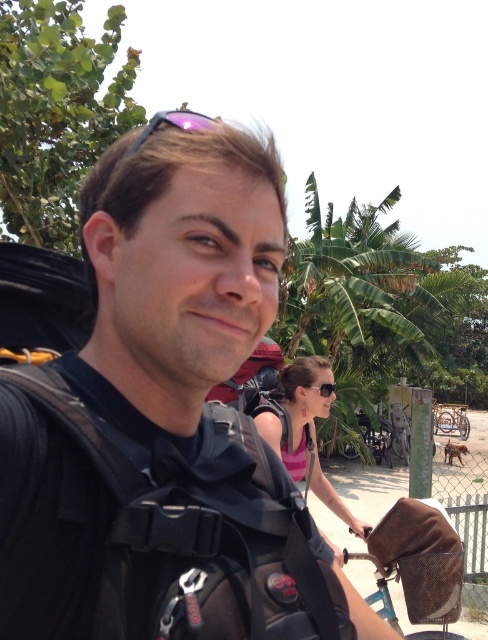
Is black backpack at center positioned at the back of purple reflective sunglasses at upper center?

No, black backpack at center is closer to the viewer.

Who is positioned more to the left, black backpack at center or purple reflective sunglasses at upper center?

From the viewer's perspective, purple reflective sunglasses at upper center appears more on the left side.

Between point (179, 538) and point (181, 113), which one is positioned in front?

Point (179, 538) is more forward.

Where is `black backpack at center`? The height and width of the screenshot is (640, 488). black backpack at center is located at coordinates (163, 422).

Which is more to the right, black backpack at center or pink fabric top at center?

pink fabric top at center

Does black backpack at center have a lesser height compared to pink fabric top at center?

Yes, black backpack at center is shorter than pink fabric top at center.

You are a GUI agent. You are given a task and a screenshot of the screen. Output one action in this format:
    pyautogui.click(x=<x>, y=<y>)
    Task: Click on the black backpack at center
    This screenshot has height=640, width=488.
    Given the screenshot: What is the action you would take?
    163,422

Where is `black backpack at center`? black backpack at center is located at coordinates (163, 422).

Does pink fabric top at center appear over purple reflective sunglasses at upper center?

Actually, pink fabric top at center is below purple reflective sunglasses at upper center.

Does point (292, 406) lie behind point (142, 144)?

Yes, point (292, 406) is farther from viewer.

The height and width of the screenshot is (640, 488). Describe the element at coordinates (304, 429) in the screenshot. I see `pink fabric top at center` at that location.

Identify the location of pink fabric top at center. This screenshot has height=640, width=488. (304, 429).